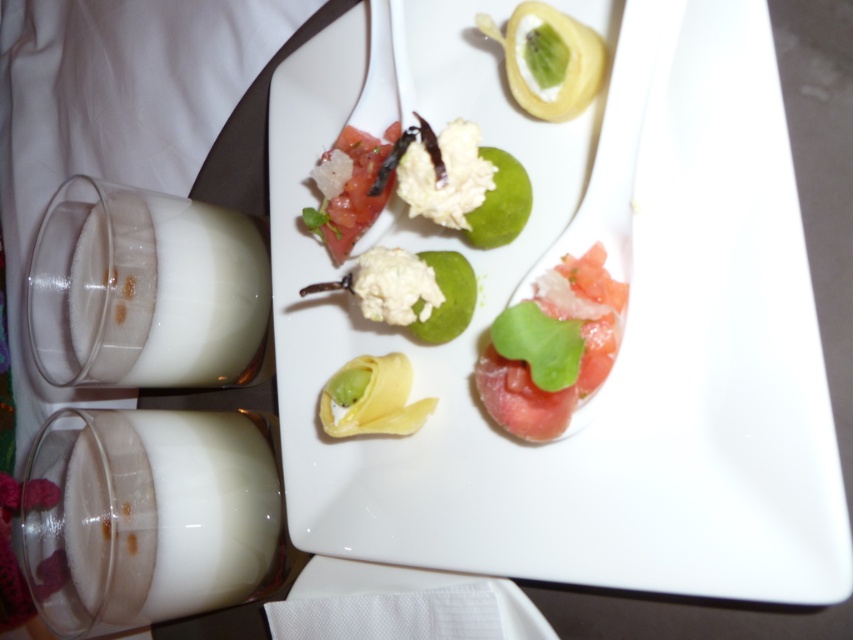
Who is more forward, (560, 33) or (396, 132)?

Point (560, 33) is more forward.

Is smooth yellow pastry at upper center smaller than matte white tomato at center?

Correct, smooth yellow pastry at upper center occupies less space than matte white tomato at center.

Identify the location of smooth yellow pastry at upper center. This screenshot has height=640, width=853. (549, 60).

Does white creamy milk at lower left have a larger size compared to matte white tomato at center?

Yes.

Who is higher up, white creamy milk at lower left or matte white tomato at center?

Positioned higher is matte white tomato at center.

Locate an element on the screen. white creamy milk at lower left is located at coordinates (169, 513).

Identify the location of white creamy milk at lower left. click(169, 513).

Is point (560, 356) closer to viewer compared to point (526, 108)?

Yes, it is in front of point (526, 108).

Measure the distance between fresh tomato at center and smooth yellow pastry at upper center.

They are 4.77 inches apart.

Which is in front, point (479, 376) or point (563, 83)?

Point (479, 376)

Locate an element on the screen. The height and width of the screenshot is (640, 853). fresh tomato at center is located at coordinates 552,348.